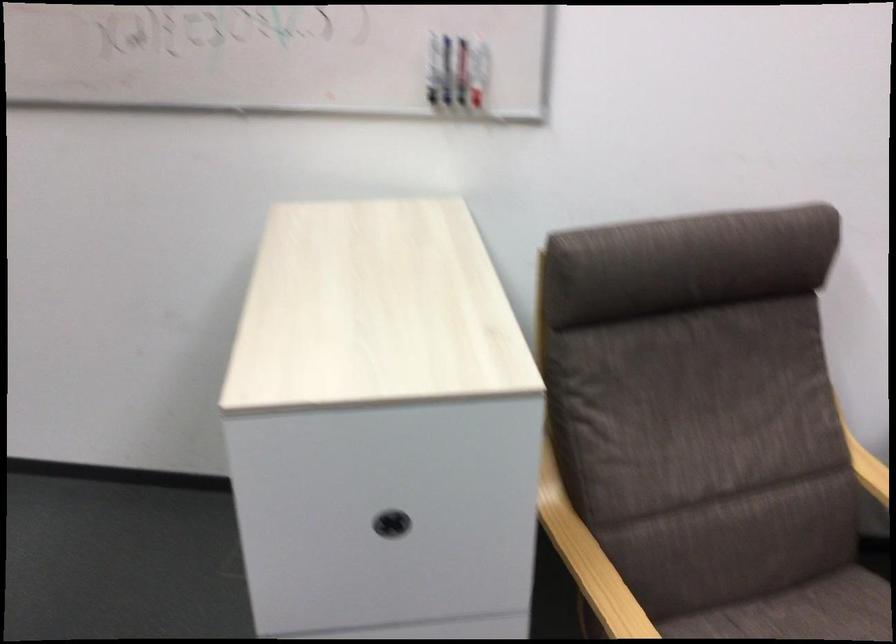
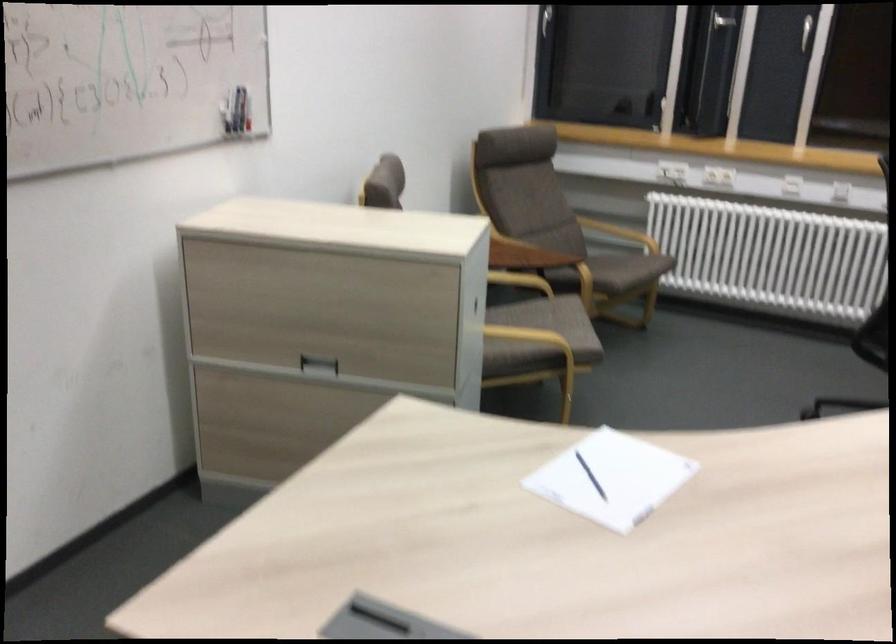
Where in the second image is the point corresponding to (445,70) from the first image?

(228, 111)